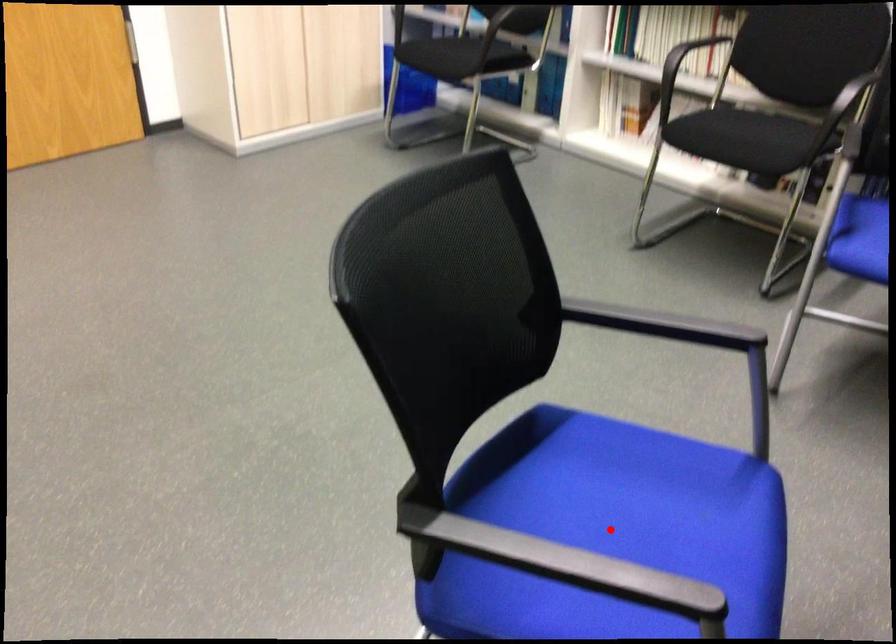
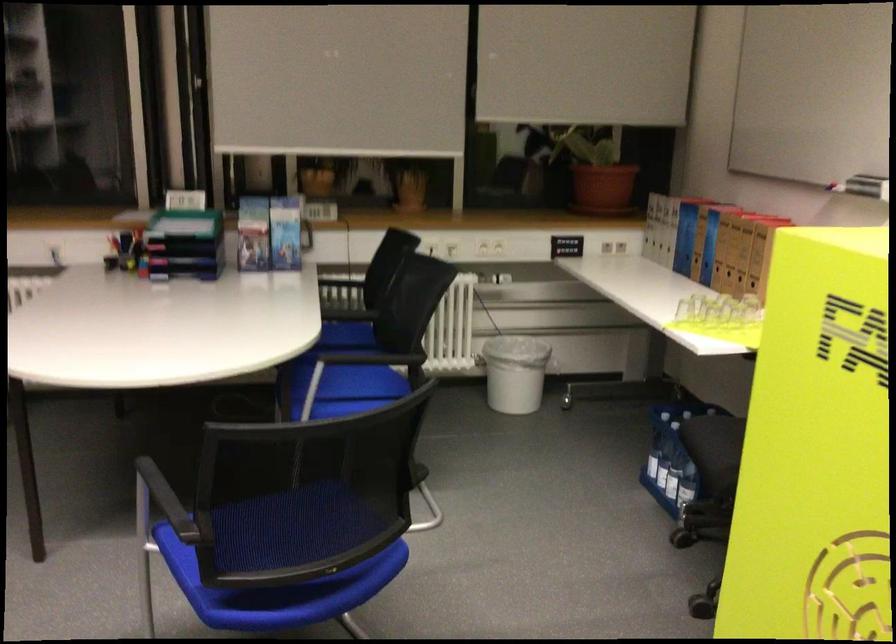
Question: I am providing you with two images of the same scene from different viewpoints. A red point is marked on the first image. Can you still see the location of the red point in image 2?

Choices:
 (A) Yes
 (B) No

Answer: (B)